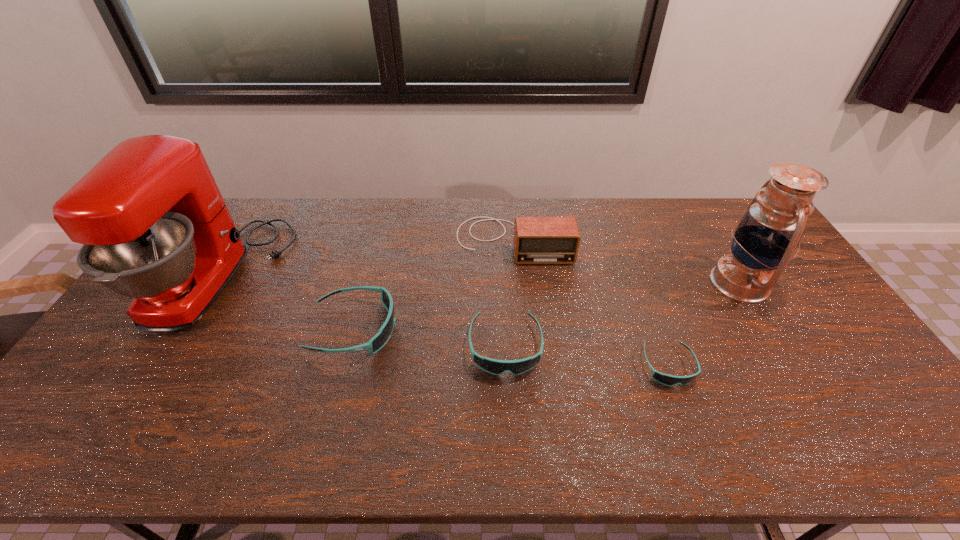
This screenshot has width=960, height=540. Identify the location of free space located on the front of the oil lamp. (773, 336).

Locate an element on the screen. The image size is (960, 540). vacant area situated on the front-facing side of the leftmost object is located at coordinates (321, 277).

Where is `free space located 0.270m on the front-facing side of the radio receiver`? This screenshot has height=540, width=960. free space located 0.270m on the front-facing side of the radio receiver is located at coordinates [x=520, y=330].

Where is `kitchen mixer that is at the far edge`? This screenshot has width=960, height=540. kitchen mixer that is at the far edge is located at coordinates (155, 227).

The height and width of the screenshot is (540, 960). Identify the location of radio receiver situated at the far edge. (537, 240).

Identify the location of object that is at the near edge. Image resolution: width=960 pixels, height=540 pixels. (669, 380).

Find the location of a particular element. This screenshot has width=960, height=540. object located at the left edge is located at coordinates (155, 227).

Find the location of a particular element. The width and height of the screenshot is (960, 540). object present at the right edge is located at coordinates (771, 229).

The image size is (960, 540). I want to click on object positioned at the far left corner, so click(x=155, y=227).

The image size is (960, 540). What are the coordinates of `vacant space at the far edge of the desktop` in the screenshot? It's located at (611, 204).